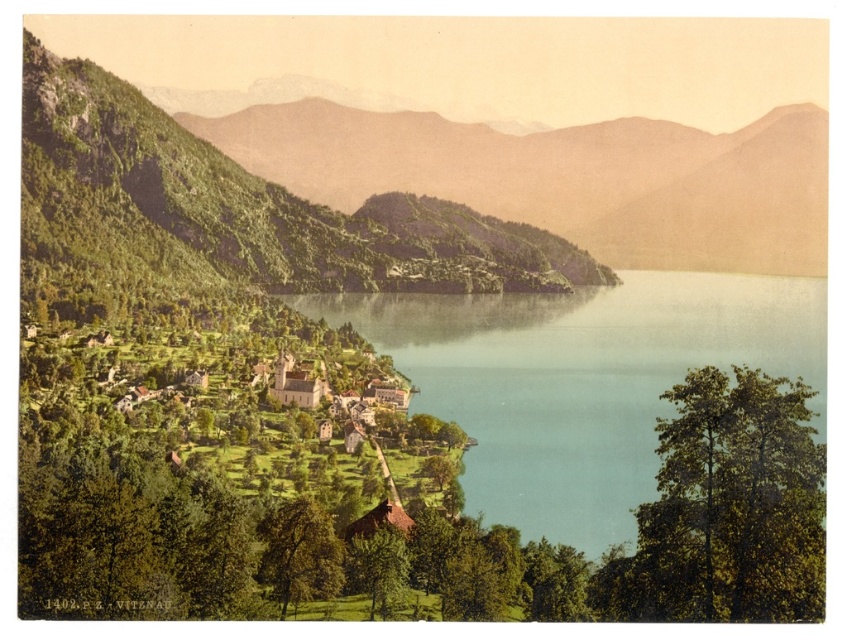
Who is more distant from viewer, [549,330] or [367,544]?

Point [549,330]

Who is more forward, (638, 342) or (389, 600)?

Positioned in front is point (389, 600).

Which is in front, point (590, 545) or point (364, 570)?

Positioned in front is point (364, 570).

You are a GUI agent. You are given a task and a screenshot of the screen. Output one action in this format:
    pyautogui.click(x=<x>, y=<y>)
    Task: Click on the blue water at center
    The image size is (847, 640).
    Given the screenshot: What is the action you would take?
    pyautogui.click(x=580, y=380)

Does blue water at center have a larger size compared to green leafy tree at lower right?

Yes.

Is blue water at center closer to the viewer compared to green leafy tree at lower right?

No, blue water at center is further to the viewer.

Between point (593, 476) and point (812, 536), which one is positioned behind?

Positioned behind is point (593, 476).

Identify the location of blue water at center. The width and height of the screenshot is (847, 640). (580, 380).

Is green leafy tree at lower right wider than green matte tree at lower left?

Indeed, green leafy tree at lower right has a greater width compared to green matte tree at lower left.

Between green leafy tree at lower right and green matte tree at lower left, which one appears on the left side from the viewer's perspective?

green matte tree at lower left is more to the left.

This screenshot has width=847, height=640. Describe the element at coordinates (734, 504) in the screenshot. I see `green leafy tree at lower right` at that location.

Where is `green leafy tree at lower right`? The width and height of the screenshot is (847, 640). green leafy tree at lower right is located at coordinates (734, 504).